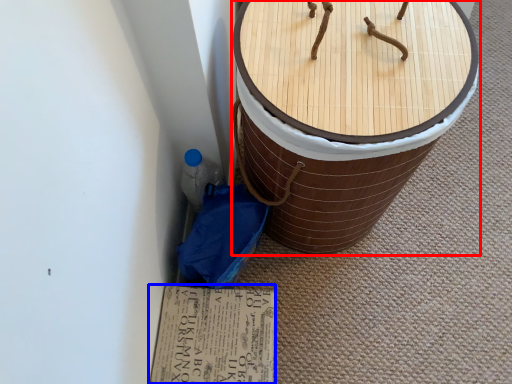
Question: Among these objects, which one is farthest to the camera, furniture (highlighted by a red box) or cardboard (highlighted by a blue box)?

Choices:
 (A) furniture
 (B) cardboard

Answer: (B)